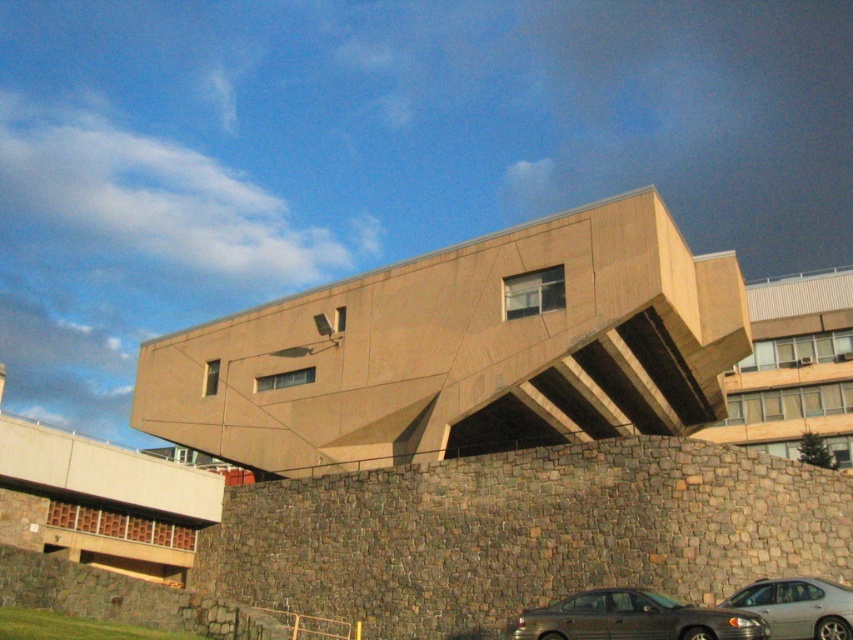
You are standing at the origin point of the coordinate system. Where is the beige concrete building at center located in terms of coordinates?

The beige concrete building at center is located at coordinates point [463,349].

You are a photographer standing at the base of the beige concrete building at center. You want to take a photo of the silver metallic sedan at lower right without the building blocking the view. Is this possible given their relative sizes?

The beige concrete building at center is taller than the silver metallic sedan at lower right, so it may block the view depending on the angle. However, since the building is elevated on a stone wall and the sedan is at lower right, positioning yourself to the side or lower might allow capturing the sedan without obstruction.

You are driving a metallic gray sedan at lower right and want to exit the parking lot. The beige concrete building at center is blocking your path. Can you move forward to exit without going around it?

The metallic gray sedan at lower right is behind the beige concrete building at center, so it cannot move forward to exit without going around the building.